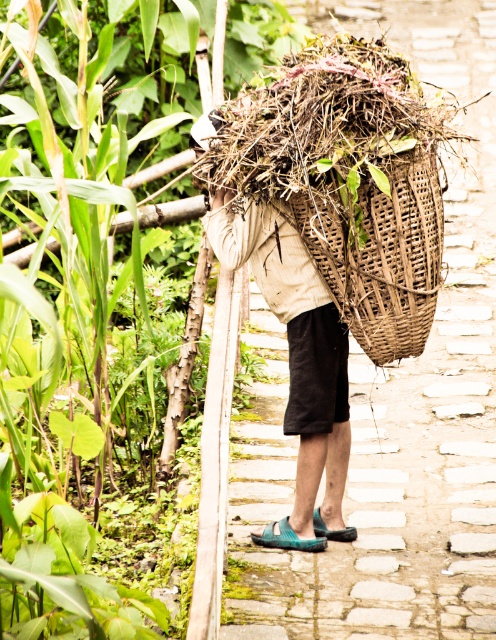
Can you confirm if brown woven basket at center is taller than woven brown basket at upper center?

Yes, brown woven basket at center is taller than woven brown basket at upper center.

Between brown woven basket at center and woven brown basket at upper center, which one is positioned higher?

Positioned higher is brown woven basket at center.

Identify the location of brown woven basket at center. (392, 467).